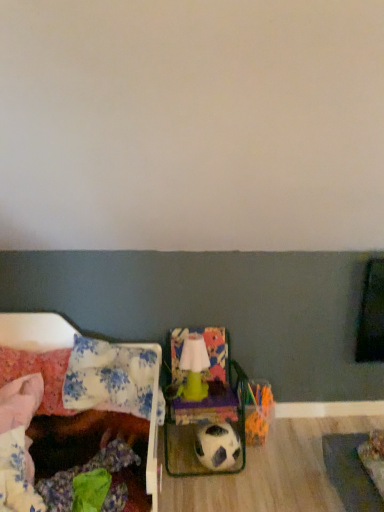
Find the location of a particular element. Image resolution: width=384 pixels, height=512 pixels. green matte lamp at center is located at coordinates (194, 368).

At what (x,y) coordinates should I click in order to perform the action: click on matte green armchair at center. Please return your answer as a coordinate pair (x, y). This screenshot has width=384, height=512. Looking at the image, I should click on (204, 406).

In order to click on floral fabric pillow at left, arranged as the 2th pillow when viewed from the left in this screenshot , I will do `click(109, 378)`.

Is floral fabric bed at left at the back of black and white textured football at center?

No, black and white textured football at center is not facing away from floral fabric bed at left.

In the scene shown: Considering the positions of objects black and white textured football at center and floral fabric bed at left in the image provided, who is in front, black and white textured football at center or floral fabric bed at left?

Positioned in front is floral fabric bed at left.

Between black and white textured football at center and floral fabric bed at left, which one appears on the right side from the viewer's perspective?

black and white textured football at center is more to the right.

From a real-world perspective, which object rests below the other?

black and white textured football at center, from a real-world perspective.

Looking at the image, does black and white textured football at center seem bigger or smaller compared to green matte lamp at center?

black and white textured football at center is bigger than green matte lamp at center.

How much distance is there between black and white textured football at center and green matte lamp at center?

A distance of 9.72 inches exists between black and white textured football at center and green matte lamp at center.

In the scene shown: Relative to green matte lamp at center, is black and white textured football at center in front or behind?

Visually, black and white textured football at center is located in front of green matte lamp at center.

Identify the location of armchair that appears on the right of floral fabric pillow at left, arranged as the 2th pillow when viewed from the left. (204, 406).

How distant is floral fabric pillow at left, which is the first pillow in right-to-left order, from matte green armchair at center?

The distance of floral fabric pillow at left, which is the first pillow in right-to-left order, from matte green armchair at center is 28.90 centimeters.

From the image's perspective, is floral fabric pillow at left, arranged as the 2th pillow when viewed from the left, located beneath matte green armchair at center?

Incorrect, from the image's perspective, floral fabric pillow at left, arranged as the 2th pillow when viewed from the left, is higher than matte green armchair at center.

Is floral fabric pillow at left, which is the first pillow in right-to-left order, turned away from matte green armchair at center?

No, floral fabric pillow at left, which is the first pillow in right-to-left order,'s orientation is not away from matte green armchair at center.

Looking at this image, is there a large distance between fluffy pink pillow at left, the first pillow viewed from the left, and matte green armchair at center?

fluffy pink pillow at left, the first pillow viewed from the left, is near matte green armchair at center, not far away.

This screenshot has height=512, width=384. I want to click on armchair that appears below the fluffy pink pillow at left, the first pillow viewed from the left (from a real-world perspective), so click(204, 406).

Does fluffy pink pillow at left, the first pillow viewed from the left, turn towards matte green armchair at center?

No, fluffy pink pillow at left, the first pillow viewed from the left, is not aimed at matte green armchair at center.

Considering the sizes of fluffy pink pillow at left, positioned as the second pillow in right-to-left order, and matte green armchair at center in the image, is fluffy pink pillow at left, positioned as the second pillow in right-to-left order, bigger or smaller than matte green armchair at center?

fluffy pink pillow at left, positioned as the second pillow in right-to-left order, is smaller than matte green armchair at center.

Which object is positioned more to the right, matte green armchair at center or green matte lamp at center?

matte green armchair at center is more to the right.

Is the position of matte green armchair at center more distant than that of green matte lamp at center?

No, matte green armchair at center is in front of green matte lamp at center.

From the image's perspective, is matte green armchair at center over green matte lamp at center?

No.

Considering the sizes of matte green armchair at center and green matte lamp at center in the image, is matte green armchair at center taller or shorter than green matte lamp at center?

In the image, matte green armchair at center appears to be taller than green matte lamp at center.

Which is less distant, (151, 445) or (55, 376)?

The point (151, 445) is closer.

Consider the image. Would you say fluffy pink pillow at left, positioned as the second pillow in right-to-left order, is part of floral fabric bed at left's contents?

Yes, fluffy pink pillow at left, positioned as the second pillow in right-to-left order, is a part of floral fabric bed at left.

In terms of height, does floral fabric bed at left look taller or shorter compared to fluffy pink pillow at left, positioned as the second pillow in right-to-left order?

floral fabric bed at left is taller than fluffy pink pillow at left, positioned as the second pillow in right-to-left order.

Who is shorter, green matte lamp at center or black and white textured football at center?

black and white textured football at center.

Would you say green matte lamp at center is inside or outside black and white textured football at center?

green matte lamp at center is not enclosed by black and white textured football at center.

From the picture: Based on their positions, is green matte lamp at center located to the left or right of black and white textured football at center?

green matte lamp at center is positioned on black and white textured football at center's left side.

From the image's perspective, which object appears higher, green matte lamp at center or black and white textured football at center?

green matte lamp at center.

This screenshot has width=384, height=512. I want to click on football behind the floral fabric bed at left, so point(217,446).

This screenshot has width=384, height=512. Find the location of `lamp above the black and white textured football at center (from the image's perspective)`. lamp above the black and white textured football at center (from the image's perspective) is located at coordinates (194, 368).

Based on their spatial positions, is floral fabric pillow at left, which is the first pillow in right-to-left order, or floral fabric bed at left closer to black and white textured football at center?

The object closer to black and white textured football at center is floral fabric bed at left.

Which object lies further to the anchor point floral fabric pillow at left, arranged as the 2th pillow when viewed from the left, floral fabric bed at left or black and white textured football at center?

The object further to floral fabric pillow at left, arranged as the 2th pillow when viewed from the left, is black and white textured football at center.

Based on their spatial positions, is fluffy pink pillow at left, positioned as the second pillow in right-to-left order, or matte green armchair at center closer to green matte lamp at center?

matte green armchair at center is positioned closer to the anchor green matte lamp at center.

Considering their positions, is floral fabric pillow at left, which is the first pillow in right-to-left order, positioned closer to matte green armchair at center than fluffy pink pillow at left, the first pillow viewed from the left?

floral fabric pillow at left, which is the first pillow in right-to-left order.

From the picture: From the image, which object appears to be nearer to green matte lamp at center, black and white textured football at center or matte green armchair at center?

The object closer to green matte lamp at center is matte green armchair at center.

Considering their positions, is matte green armchair at center positioned closer to fluffy pink pillow at left, the first pillow viewed from the left, than green matte lamp at center?

green matte lamp at center.

Estimate the real-world distances between objects in this image. Which object is closer to black and white textured football at center, matte green armchair at center or floral fabric pillow at left, arranged as the 2th pillow when viewed from the left?

matte green armchair at center is closer to black and white textured football at center.

Which object lies nearer to the anchor point matte green armchair at center, green matte lamp at center or floral fabric pillow at left, arranged as the 2th pillow when viewed from the left?

green matte lamp at center is closer to matte green armchair at center.

Identify the location of armchair positioned between floral fabric bed at left and green matte lamp at center from near to far. The height and width of the screenshot is (512, 384). (204, 406).

Where is `pillow between fluffy pink pillow at left, the first pillow viewed from the left, and green matte lamp at center, in the horizontal direction`? pillow between fluffy pink pillow at left, the first pillow viewed from the left, and green matte lamp at center, in the horizontal direction is located at coordinates (109, 378).

This screenshot has height=512, width=384. In order to click on armchair situated between fluffy pink pillow at left, positioned as the second pillow in right-to-left order, and black and white textured football at center from left to right in this screenshot , I will do `click(204, 406)`.

Image resolution: width=384 pixels, height=512 pixels. I want to click on lamp situated between fluffy pink pillow at left, the first pillow viewed from the left, and black and white textured football at center from left to right, so click(194, 368).